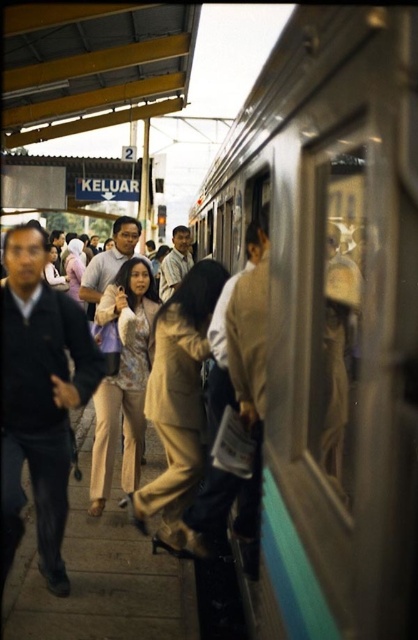
You are standing on the platform and see the silver metallic train at center and the beige fabric dress at center. Which object is positioned to the right side of the platform?

The silver metallic train at center is positioned to the right of the beige fabric dress at center, so the silver metallic train at center is on the right side of the platform.

You are standing at point (331, 317) on the platform. What object is located exactly at your feet?

The silver metallic train at center is located exactly at point (331, 317).